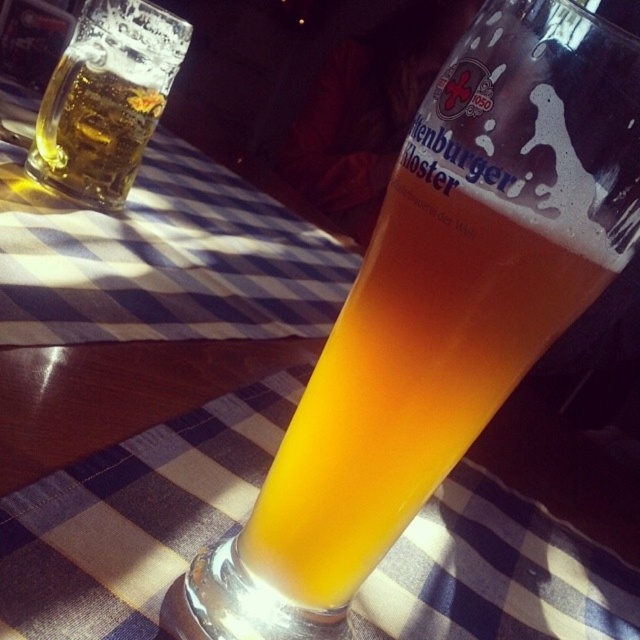
Question: Is translucent glass beer at center to the right of translucent glass mug at upper left from the viewer's perspective?

Choices:
 (A) yes
 (B) no

Answer: (A)

Question: Does translucent glass beer at center appear under translucent glass mug at upper left?

Choices:
 (A) yes
 (B) no

Answer: (A)

Question: Which point is closer to the camera?

Choices:
 (A) (102, 36)
 (B) (305, 467)

Answer: (B)

Question: Can you confirm if translucent glass beer at center is thinner than translucent glass mug at upper left?

Choices:
 (A) no
 (B) yes

Answer: (A)